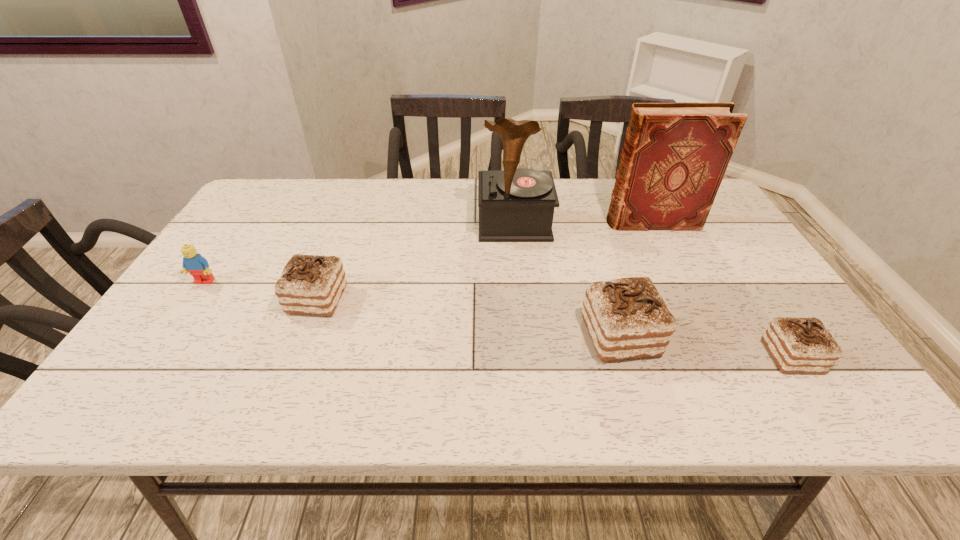
Locate an element on the screen. Image resolution: width=960 pixels, height=540 pixels. location for an additional chocolate_cake to make spacing equal is located at coordinates (463, 317).